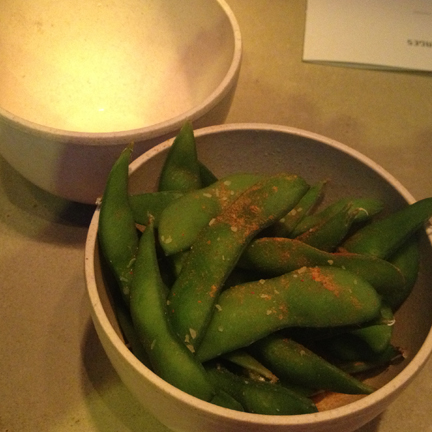
Where is `bowl`? bowl is located at coordinates (173, 391), (345, 181), (212, 37), (33, 145).